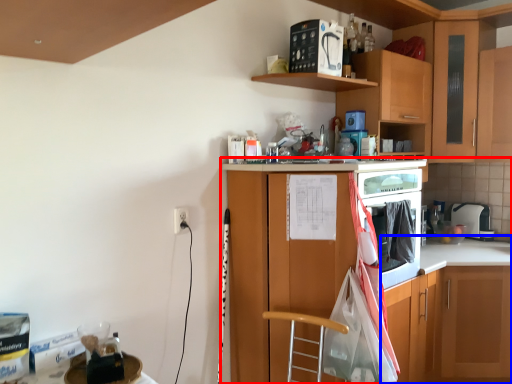
Question: Among these objects, which one is farthest to the camera, cabinetry (highlighted by a red box) or counter (highlighted by a blue box)?

Choices:
 (A) cabinetry
 (B) counter

Answer: (B)